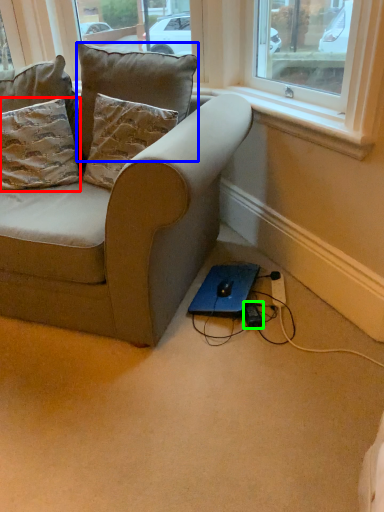
Question: Which object is positioned closest to pillow (highlighted by a red box)? Select from pillow (highlighted by a blue box) and plug (highlighted by a green box).

Choices:
 (A) pillow
 (B) plug

Answer: (A)